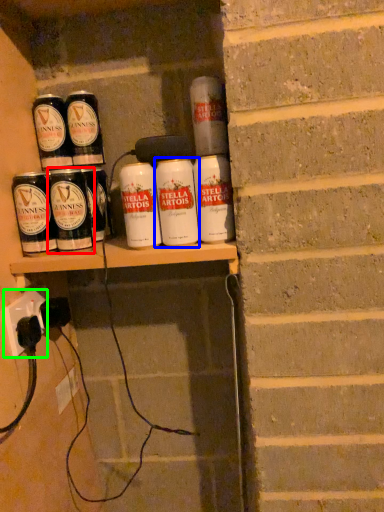
Question: Which object is positioned farthest from tin can (highlighted by a red box)? Select from tin can (highlighted by a blue box) and electric outlet (highlighted by a green box).

Choices:
 (A) tin can
 (B) electric outlet

Answer: (A)